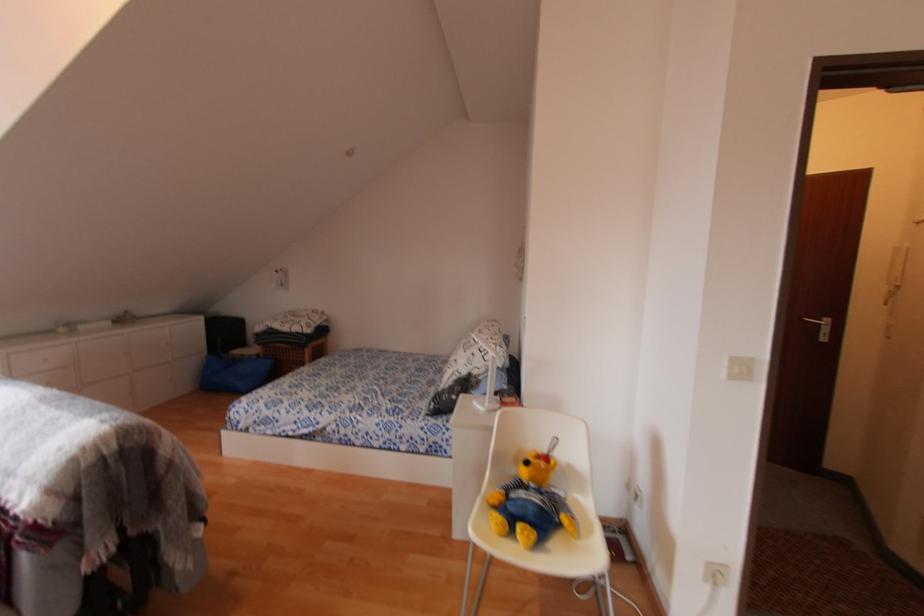
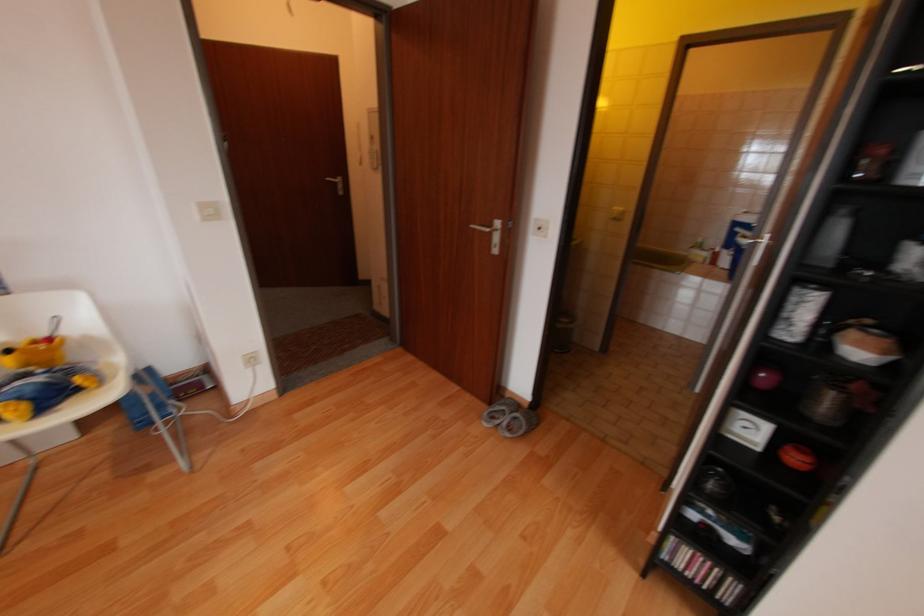
First-person continuous shooting, in which direction is the camera rotating?

The camera rotated toward right-down.